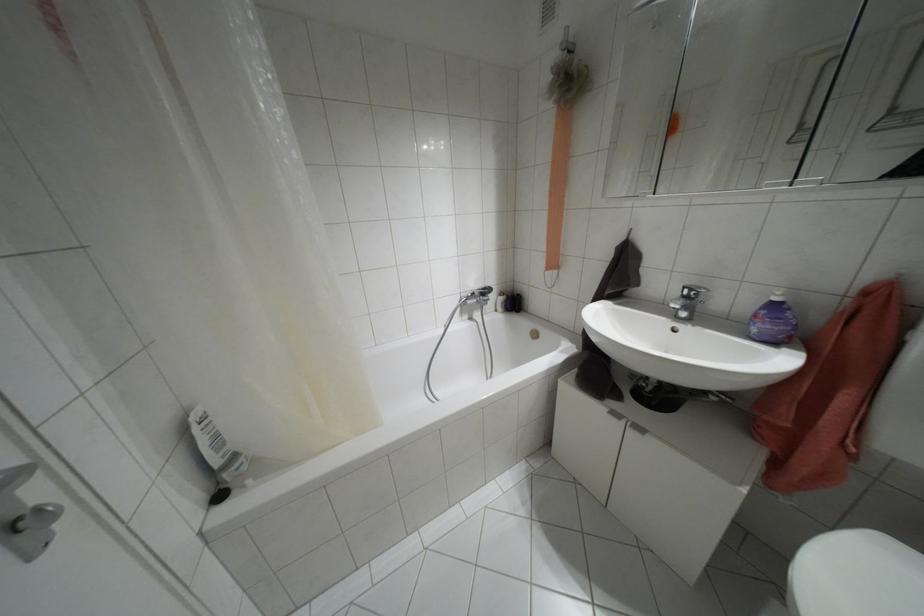
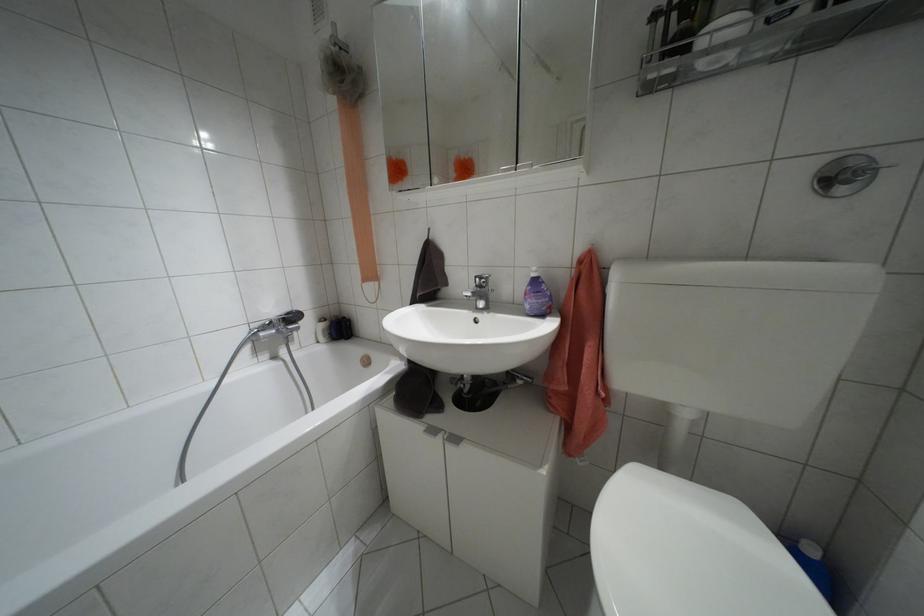
Locate, in the second image, the point that corresponds to point (638, 429) in the first image.

(455, 439)